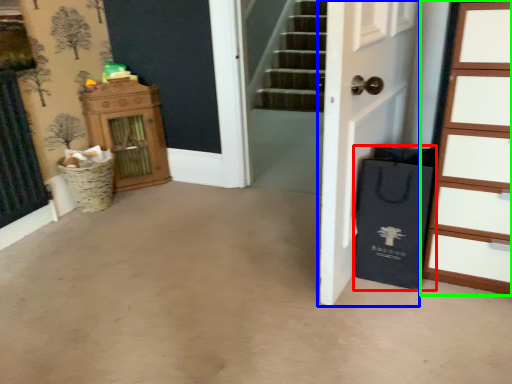
Question: Which object is the farthest from shopping bag (highlighted by a red box)? Choose among these: door (highlighted by a blue box) or chest of drawers (highlighted by a green box).

Choices:
 (A) door
 (B) chest of drawers

Answer: (A)